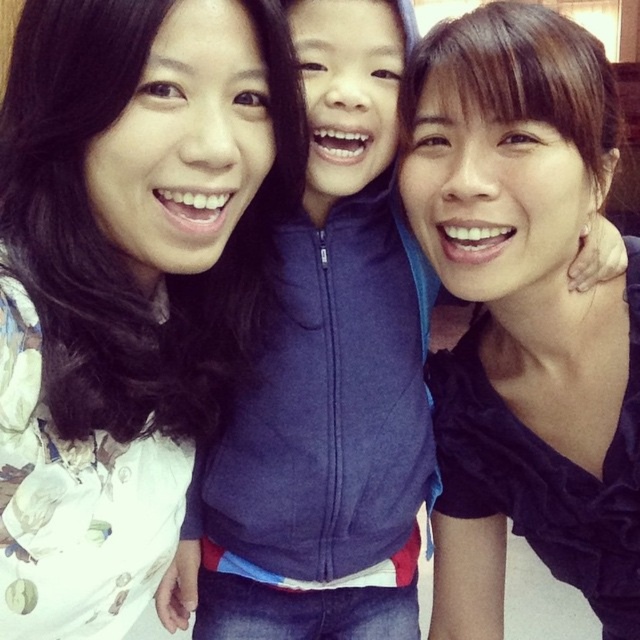
Does white floral shirt at upper left have a larger size compared to blue fleece jacket at center?

No.

Is white floral shirt at upper left above blue fleece jacket at center?

Indeed, white floral shirt at upper left is positioned over blue fleece jacket at center.

Does point (35, 632) lie behind point (182, 547)?

No, (35, 632) is in front of (182, 547).

Find the location of a particular element. white floral shirt at upper left is located at coordinates 125,282.

Does matte black top at center have a smaller size compared to blue fleece jacket at center?

Correct, matte black top at center occupies less space than blue fleece jacket at center.

Is matte black top at center above blue fleece jacket at center?

Correct, matte black top at center is located above blue fleece jacket at center.

Is point (609, 156) behind point (346, 88)?

Yes, point (609, 156) is farther from viewer.

Find the location of a particular element. This screenshot has width=640, height=640. matte black top at center is located at coordinates (x=524, y=314).

Is white floral shirt at upper left to the right of matte black top at center from the viewer's perspective?

In fact, white floral shirt at upper left is to the left of matte black top at center.

Looking at this image, who is higher up, white floral shirt at upper left or matte black top at center?

white floral shirt at upper left is above.

Does point (243, 186) come farther from viewer compared to point (456, 390)?

No, it is not.

Identify the location of white floral shirt at upper left. Image resolution: width=640 pixels, height=640 pixels. (125, 282).